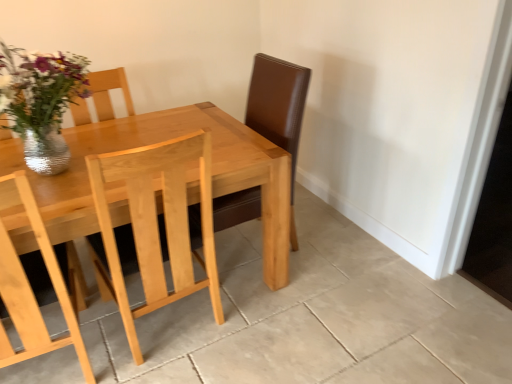
Identify the location of vacant space to the right of light wood table at center. The image size is (512, 384). (335, 299).